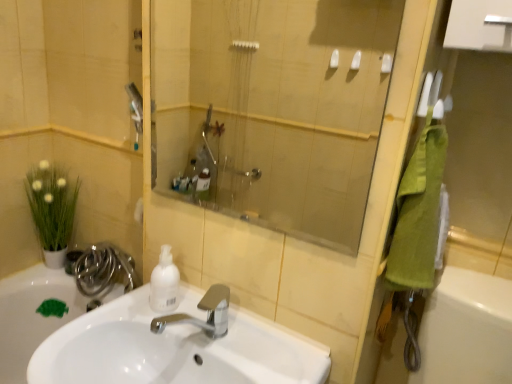
Question: Considering the positions of polished chrome hose at lower left and white glossy sink at center in the image, is polished chrome hose at lower left bigger or smaller than white glossy sink at center?

Choices:
 (A) small
 (B) big

Answer: (A)

Question: From the image's perspective, is polished chrome hose at lower left located above or below white glossy sink at center?

Choices:
 (A) below
 (B) above

Answer: (B)

Question: Which object is positioned closest to the green matte plant at left?

Choices:
 (A) white matte bottle at center
 (B) polished chrome hose at lower left
 (C) green matte soap dispenser at lower left
 (D) white glossy sink at center
 (E) transparent glass shower at center

Answer: (B)

Question: Considering the real-world distances, which object is farthest from the polished chrome hose at lower left?

Choices:
 (A) green towel at right
 (B) transparent glass shower at center
 (C) white matte bottle at center
 (D) green matte plant at left
 (E) green matte soap dispenser at lower left

Answer: (A)